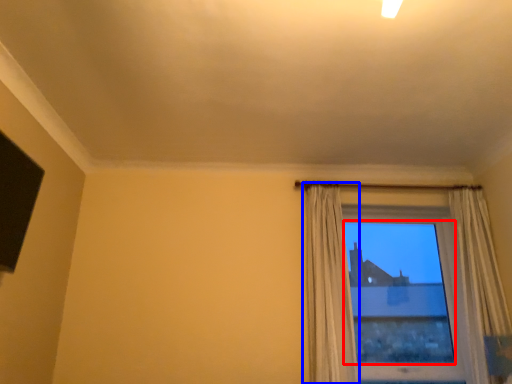
Question: Which object is further to the camera taking this photo, window screen (highlighted by a red box) or curtain (highlighted by a blue box)?

Choices:
 (A) window screen
 (B) curtain

Answer: (A)